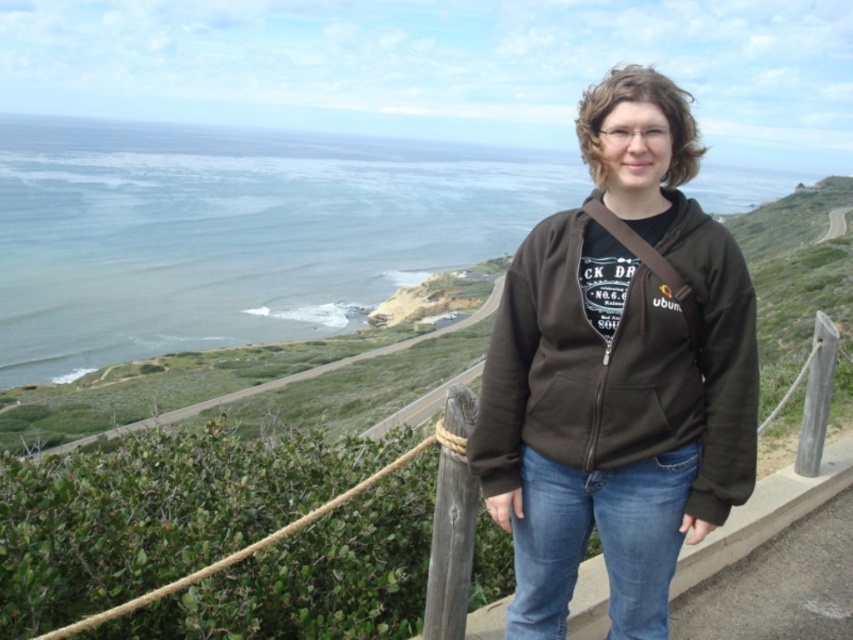
You are an observer looking at the coastal scene. You notice the dark brown fleece sweatshirt at center and the blue denim jeans at lower center. Which item of clothing appears bigger in the image?

The dark brown fleece sweatshirt at center appears bigger than the blue denim jeans at lower center in the image.

You are a photographer standing on the coast and want to take a closeup shot of the dark brown fleece sweatshirt at center. Your camera has a maximum focus range of 3 meters. Can you capture the sweatshirt clearly?

The dark brown fleece sweatshirt at center is 3.05 meters away from the viewer. Since the camera can only focus up to 3 meters, it cannot capture the sweatshirt clearly as it is slightly beyond the maximum focus range.